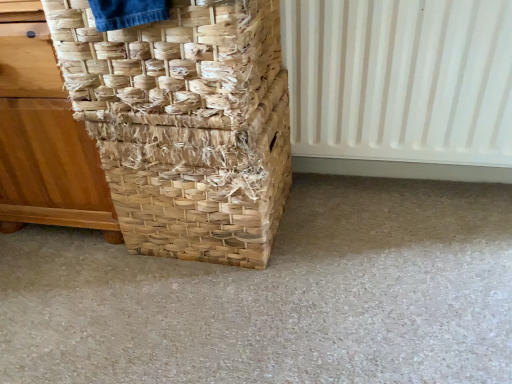
What do you see at coordinates (400, 79) in the screenshot?
I see `white plastic radiator at right` at bounding box center [400, 79].

Locate an element on the screen. natural woven basket at left, positioned as the 1th basket in top-to-bottom order is located at coordinates (170, 61).

What are the coordinates of `natural woven basket at left` in the screenshot? It's located at (44, 135).

Consider the image. Measure the distance between point (x=100, y=199) and camera.

Point (x=100, y=199) is 3.37 feet away from camera.

At what (x,y) coordinates should I click in order to perform the action: click on white plastic radiator at right. Please return your answer as a coordinate pair (x, y). Image resolution: width=512 pixels, height=384 pixels. Looking at the image, I should click on (400, 79).

Based on the photo, is the surface of natural woven basket at left in direct contact with natural woven basket at left, the 2th basket when ordered from bottom to top?

No, natural woven basket at left is not in contact with natural woven basket at left, the 2th basket when ordered from bottom to top.

Is natural woven basket at left in front of natural woven basket at left, the 2th basket when ordered from bottom to top?

No, natural woven basket at left is further to the viewer.

Is natural woven basket at left located outside natural woven basket at left, the 2th basket when ordered from bottom to top?

natural woven basket at left is positioned outside natural woven basket at left, the 2th basket when ordered from bottom to top.

From a real-world perspective, relative to natural woven basket at left, the 2th basket when ordered from bottom to top, is natural woven basket at left vertically above or below?

natural woven basket at left is below natural woven basket at left, the 2th basket when ordered from bottom to top.

Which object is more forward, natural woven basket at left, positioned as the 1th basket in top-to-bottom order, or natural woven basket at left?

natural woven basket at left, positioned as the 1th basket in top-to-bottom order, is more forward.

From the image's perspective, is natural woven basket at left, the 2th basket when ordered from bottom to top, located above natural woven basket at left?

Yes, from the image's perspective, natural woven basket at left, the 2th basket when ordered from bottom to top, is on top of natural woven basket at left.

Which is further, (211,57) or (20,83)?

Point (20,83)

Where is `furniture that is under the natural woven basket at left, positioned as the 1th basket in top-to-bottom order (from a real-world perspective)`? furniture that is under the natural woven basket at left, positioned as the 1th basket in top-to-bottom order (from a real-world perspective) is located at coordinates (44, 135).

Does white plastic radiator at right have a greater width compared to natural woven basket at left, positioned as the 1th basket in top-to-bottom order?

Incorrect, the width of white plastic radiator at right does not surpass that of natural woven basket at left, positioned as the 1th basket in top-to-bottom order.

The width and height of the screenshot is (512, 384). Identify the location of the 2nd basket in front when counting from the white plastic radiator at right. (170, 61).

Which object is further away from the camera taking this photo, white plastic radiator at right or natural woven basket at left, positioned as the 1th basket in top-to-bottom order?

Positioned behind is white plastic radiator at right.

Looking at this image, how different are the orientations of natural woven basket at center, the first basket ordered from the bottom, and natural woven basket at left in degrees?

They differ by 0.000219 degrees in their facing directions.

Is natural woven basket at center, the first basket ordered from the bottom, to the left or to the right of natural woven basket at left in the image?

Based on their positions, natural woven basket at center, the first basket ordered from the bottom, is located to the right of natural woven basket at left.

In the scene shown: Which object is more forward, natural woven basket at center, which ranks as the second basket in top-to-bottom order, or natural woven basket at left?

natural woven basket at left.

Can you confirm if natural woven basket at center, which ranks as the second basket in top-to-bottom order, is taller than natural woven basket at left?

Incorrect, the height of natural woven basket at center, which ranks as the second basket in top-to-bottom order, is not larger of that of natural woven basket at left.

The height and width of the screenshot is (384, 512). What are the coordinates of `the 1st basket in front of the white plastic radiator at right` in the screenshot? It's located at (186, 124).

In terms of height, does white plastic radiator at right look taller or shorter compared to natural woven basket at center, the first basket ordered from the bottom?

Considering their sizes, white plastic radiator at right has more height than natural woven basket at center, the first basket ordered from the bottom.

Would you say white plastic radiator at right is a long distance from natural woven basket at center, the first basket ordered from the bottom?

That's not correct — white plastic radiator at right is a little close to natural woven basket at center, the first basket ordered from the bottom.

How many degrees apart are the facing directions of white plastic radiator at right and natural woven basket at center, which ranks as the second basket in top-to-bottom order?

There is a 0.288-degree angle between the facing directions of white plastic radiator at right and natural woven basket at center, which ranks as the second basket in top-to-bottom order.

Relative to natural woven basket at center, which ranks as the second basket in top-to-bottom order, is natural woven basket at left in front or behind?

natural woven basket at left is positioned closer to the viewer than natural woven basket at center, which ranks as the second basket in top-to-bottom order.

At what (x,y) coordinates should I click in order to perform the action: click on the 2nd basket to the right of the natural woven basket at left, counting from the anchor's position. Please return your answer as a coordinate pair (x, y). Image resolution: width=512 pixels, height=384 pixels. Looking at the image, I should click on (186, 124).

From a real-world perspective, does natural woven basket at left stand above natural woven basket at center, which ranks as the second basket in top-to-bottom order?

Correct, in the physical world, natural woven basket at left is higher than natural woven basket at center, which ranks as the second basket in top-to-bottom order.

Consider the image. From a real-world perspective, is natural woven basket at left, the 2th basket when ordered from bottom to top, physically below white plastic radiator at right?

No, from a real-world perspective, natural woven basket at left, the 2th basket when ordered from bottom to top, is not beneath white plastic radiator at right.

How distant is natural woven basket at left, the 2th basket when ordered from bottom to top, from white plastic radiator at right?

A distance of 17.42 inches exists between natural woven basket at left, the 2th basket when ordered from bottom to top, and white plastic radiator at right.

Considering the sizes of natural woven basket at left, positioned as the 1th basket in top-to-bottom order, and white plastic radiator at right in the image, is natural woven basket at left, positioned as the 1th basket in top-to-bottom order, bigger or smaller than white plastic radiator at right?

Considering their sizes, natural woven basket at left, positioned as the 1th basket in top-to-bottom order, takes up more space than white plastic radiator at right.

Which is closer to the camera, (134, 92) or (366, 53)?

Point (134, 92) is closer to the camera than point (366, 53).

The image size is (512, 384). In order to click on the 1st basket counting from the right of the natural woven basket at left in this screenshot , I will do `click(170, 61)`.

There is a natural woven basket at left. Identify the location of basket above it (from a real-world perspective). This screenshot has height=384, width=512. (170, 61).

Based on the photo, estimate the real-world distances between objects in this image. Which object is further from natural woven basket at left, natural woven basket at center, which ranks as the second basket in top-to-bottom order, or white plastic radiator at right?

white plastic radiator at right is further to natural woven basket at left.

Consider the image. Estimate the real-world distances between objects in this image. Which object is further from natural woven basket at center, which ranks as the second basket in top-to-bottom order, natural woven basket at left or white plastic radiator at right?

The object further to natural woven basket at center, which ranks as the second basket in top-to-bottom order, is white plastic radiator at right.

From the image, which object appears to be farther from white plastic radiator at right, natural woven basket at left or natural woven basket at center, the first basket ordered from the bottom?

natural woven basket at left is positioned further to the anchor white plastic radiator at right.

Based on their spatial positions, is white plastic radiator at right or natural woven basket at center, which ranks as the second basket in top-to-bottom order, further from natural woven basket at left, the 2th basket when ordered from bottom to top?

Based on the image, white plastic radiator at right appears to be further to natural woven basket at left, the 2th basket when ordered from bottom to top.

From the image, which object appears to be nearer to natural woven basket at left, natural woven basket at left, the 2th basket when ordered from bottom to top, or natural woven basket at center, which ranks as the second basket in top-to-bottom order?

natural woven basket at center, which ranks as the second basket in top-to-bottom order, is positioned closer to the anchor natural woven basket at left.

Estimate the real-world distances between objects in this image. Which object is closer to white plastic radiator at right, natural woven basket at center, which ranks as the second basket in top-to-bottom order, or natural woven basket at left?

natural woven basket at center, which ranks as the second basket in top-to-bottom order, is positioned closer to the anchor white plastic radiator at right.

Which object lies nearer to the anchor point white plastic radiator at right, natural woven basket at center, which ranks as the second basket in top-to-bottom order, or natural woven basket at left, the 2th basket when ordered from bottom to top?

natural woven basket at center, which ranks as the second basket in top-to-bottom order.

Looking at this image, considering their positions, is white plastic radiator at right positioned closer to natural woven basket at left, positioned as the 1th basket in top-to-bottom order, than natural woven basket at left?

The object closer to natural woven basket at left, positioned as the 1th basket in top-to-bottom order, is natural woven basket at left.

In order to click on basket located between natural woven basket at left, the 2th basket when ordered from bottom to top, and white plastic radiator at right in the left-right direction in this screenshot , I will do `click(186, 124)`.

You are a GUI agent. You are given a task and a screenshot of the screen. Output one action in this format:
    pyautogui.click(x=<x>, y=<y>)
    Task: Click on the basket between natural woven basket at left and natural woven basket at center, which ranks as the second basket in top-to-bottom order, in the horizontal direction
    The image size is (512, 384).
    Given the screenshot: What is the action you would take?
    pyautogui.click(x=170, y=61)